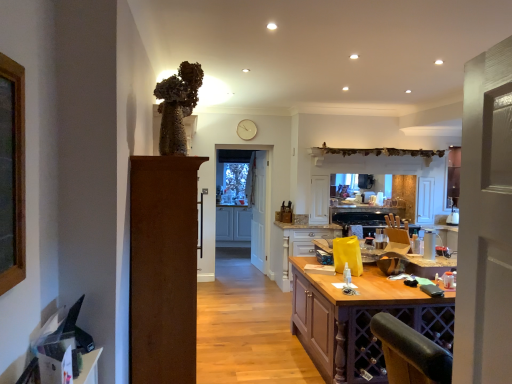
Locate an element on the screen. The image size is (512, 384). white wooden door at center, the first door viewed from the back is located at coordinates (258, 211).

The height and width of the screenshot is (384, 512). I want to click on wooden countertop at center, which is the second cabinetry from back to front, so click(297, 246).

What are the coordinates of `clear glass door at center` in the screenshot? It's located at (243, 200).

At what (x,y) coordinates should I click in order to perform the action: click on white wooden door at center, marked as the 2th door in a front-to-back arrangement. Please return your answer as a coordinate pair (x, y). This screenshot has height=384, width=512. Looking at the image, I should click on (258, 211).

Based on the photo, is clear glass door at center facing towards purple wood table at center?

No, clear glass door at center is not aimed at purple wood table at center.

From a real-world perspective, is clear glass door at center located beneath purple wood table at center?

Actually, clear glass door at center is physically above purple wood table at center in the real world.

From the image's perspective, which is below, clear glass door at center or purple wood table at center?

Result: purple wood table at center appears lower in the image.

From a real-world perspective, is clear glass door at center above or below white glossy cabinets at center, marked as the 1th cabinetry in a left-to-right arrangement?

clear glass door at center is situated higher than white glossy cabinets at center, marked as the 1th cabinetry in a left-to-right arrangement, in the real world.

From the image's perspective, between clear glass door at center and white glossy cabinets at center, arranged as the 2th cabinetry when viewed from the right, which one is located above?

clear glass door at center, from the image's perspective.

Which of these two, clear glass door at center or white glossy cabinets at center, marked as the 1th cabinetry in a left-to-right arrangement, stands taller?

Standing taller between the two is clear glass door at center.

Looking at this image, is clear glass door at center positioned beyond the bounds of white glossy cabinets at center, marked as the 1th cabinetry in a left-to-right arrangement?

Yes, clear glass door at center is outside of white glossy cabinets at center, marked as the 1th cabinetry in a left-to-right arrangement.

Does white glossy cabinets at center, arranged as the 2th cabinetry when viewed from the right, appear on the left side of brown wood door at left, marked as the 1th door in a left-to-right arrangement?

Incorrect, white glossy cabinets at center, arranged as the 2th cabinetry when viewed from the right, is not on the left side of brown wood door at left, marked as the 1th door in a left-to-right arrangement.

Is white glossy cabinets at center, arranged as the 2th cabinetry when viewed from the right, not close to brown wood door at left, arranged as the first door when viewed from the front?

white glossy cabinets at center, arranged as the 2th cabinetry when viewed from the right, is positioned a significant distance from brown wood door at left, arranged as the first door when viewed from the front.

From a real-world perspective, between white glossy cabinets at center, arranged as the 2th cabinetry when viewed from the right, and brown wood door at left, marked as the 2th door in a right-to-left arrangement, who is vertically higher?

brown wood door at left, marked as the 2th door in a right-to-left arrangement, is physically above.

Consider the image. Is brown wood door at left, the second door from the back, at the back of white glossy cabinets at center, which appears as the first cabinetry when viewed from the back?

No, white glossy cabinets at center, which appears as the first cabinetry when viewed from the back,'s orientation is not away from brown wood door at left, the second door from the back.

From the image's perspective, is white plastic spray bottle at center above or below white wooden door at center, acting as the second door starting from the left?

From the image's perspective, white plastic spray bottle at center appears below white wooden door at center, acting as the second door starting from the left.

In the image, is white plastic spray bottle at center on the left side or the right side of white wooden door at center, marked as the 2th door in a front-to-back arrangement?

white plastic spray bottle at center is positioned on white wooden door at center, marked as the 2th door in a front-to-back arrangement,'s right side.

Which object is closer to the camera taking this photo, white plastic spray bottle at center or white wooden door at center, the first door when ordered from right to left?

white plastic spray bottle at center is closer to the camera.

From the image's perspective, is purple wood table at center under white glossy cabinets at center, marked as the 1th cabinetry in a left-to-right arrangement?

Yes, from the image's perspective, purple wood table at center is beneath white glossy cabinets at center, marked as the 1th cabinetry in a left-to-right arrangement.

Measure the distance from purple wood table at center to white glossy cabinets at center, marked as the 1th cabinetry in a left-to-right arrangement.

They are 13.94 feet apart.

Looking at this image, from a real-world perspective, between purple wood table at center and white glossy cabinets at center, arranged as the 2th cabinetry when viewed from the right, who is vertically lower?

purple wood table at center is physically lower.

Which point is more forward, (387, 300) or (234, 211)?

Point (387, 300)

Is purple wood table at center at the right side of clear glass door at center?

Indeed, purple wood table at center is positioned on the right side of clear glass door at center.

Is purple wood table at center in contact with clear glass door at center?

No, purple wood table at center is not next to clear glass door at center.

Considering the sizes of objects purple wood table at center and clear glass door at center in the image provided, who is taller, purple wood table at center or clear glass door at center?

Standing taller between the two is clear glass door at center.

How much distance is there between purple wood table at center and clear glass door at center?

The distance of purple wood table at center from clear glass door at center is 11.68 feet.

Find the location of a particular element. This screenshot has height=384, width=512. appliance that appears above the white glossy cabinets at center, marked as the 1th cabinetry in a left-to-right arrangement (from a real-world perspective) is located at coordinates (429, 244).

Is point (428, 240) closer or farther from the camera than point (216, 209)?

Point (428, 240) is positioned closer to the camera compared to point (216, 209).

Is white glossy cabinets at center, arranged as the 2th cabinetry when viewed from the right, at the back of white plastic spray bottle at center?

No, white plastic spray bottle at center's orientation is not away from white glossy cabinets at center, arranged as the 2th cabinetry when viewed from the right.

At what (x,y) coordinates should I click in order to perform the action: click on table below the clear glass door at center (from the image's perspective). Please return your answer as a coordinate pair (x, y). This screenshot has width=512, height=384. Looking at the image, I should click on (359, 320).

There is a clear glass door at center. Where is `the 1st cabinetry below it (from a real-world perspective)`? This screenshot has height=384, width=512. the 1st cabinetry below it (from a real-world perspective) is located at coordinates (233, 223).

Estimate the real-world distances between objects in this image. Which object is closer to white glossy cabinets at center, marked as the 1th cabinetry in a left-to-right arrangement, white plastic spray bottle at center or purple wood table at center?

Based on the image, purple wood table at center appears to be nearer to white glossy cabinets at center, marked as the 1th cabinetry in a left-to-right arrangement.

Looking at this image, which object lies nearer to the anchor point white plastic spray bottle at center, brown wood door at left, marked as the 1th door in a left-to-right arrangement, or purple wood table at center?

The object closer to white plastic spray bottle at center is purple wood table at center.

From the image, which object appears to be nearer to white glossy cabinets at center, marked as the 1th cabinetry in a left-to-right arrangement, clear glass door at center or white plastic spray bottle at center?

clear glass door at center.

Looking at the image, which one is located further to white glossy cabinets at center, arranged as the 2th cabinetry when viewed from the right, purple wood table at center or white plastic spray bottle at center?

white plastic spray bottle at center is positioned further to the anchor white glossy cabinets at center, arranged as the 2th cabinetry when viewed from the right.

In the scene shown: Based on their spatial positions, is white plastic spray bottle at center or clear glass door at center further from brown wood door at left, arranged as the first door when viewed from the front?

Among the two, clear glass door at center is located further to brown wood door at left, arranged as the first door when viewed from the front.

From the image, which object appears to be farther from brown wood door at left, arranged as the first door when viewed from the front, white glossy cabinets at center, marked as the 1th cabinetry in a left-to-right arrangement, or white plastic spray bottle at center?

white glossy cabinets at center, marked as the 1th cabinetry in a left-to-right arrangement.

From the picture: Looking at the image, which one is located further to wooden countertop at center, which is the second cabinetry from back to front, white glossy cabinets at center, arranged as the 2th cabinetry when viewed from the right, or white plastic spray bottle at center?

white plastic spray bottle at center.

Which object lies further to the anchor point brown wood door at left, arranged as the first door when viewed from the front, white plastic spray bottle at center or wooden countertop at center, which is the second cabinetry from back to front?

wooden countertop at center, which is the second cabinetry from back to front.

What are the coordinates of `cabinetry between white plastic spray bottle at center and white glossy cabinets at center, arranged as the 2th cabinetry when viewed from the right, from front to back` in the screenshot? It's located at (297, 246).

Locate an element on the screen. table between brown wood door at left, arranged as the first door when viewed from the front, and white wooden door at center, the first door viewed from the back, from front to back is located at coordinates (359, 320).

Identify the location of glass door between wooden countertop at center, which is the second cabinetry from back to front, and white wooden door at center, marked as the 2th door in a front-to-back arrangement, in the front-back direction. (243, 200).

Locate an element on the screen. The height and width of the screenshot is (384, 512). door located between clear glass door at center and white glossy cabinets at center, which is the second cabinetry in front-to-back order, in the depth direction is located at coordinates (258, 211).